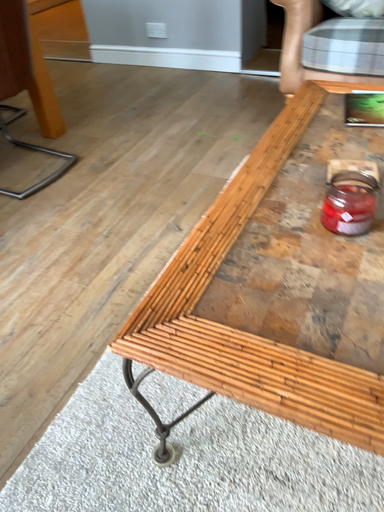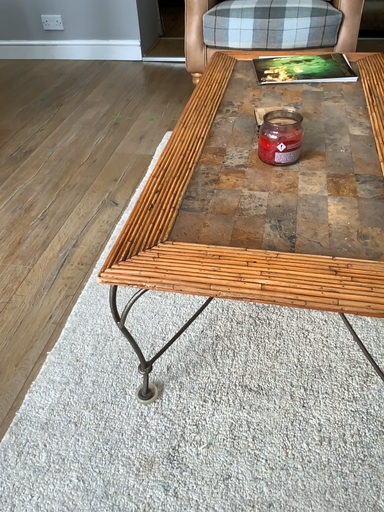
Question: How did the camera likely rotate when shooting the video?

Choices:
 (A) rotated right
 (B) rotated left

Answer: (A)